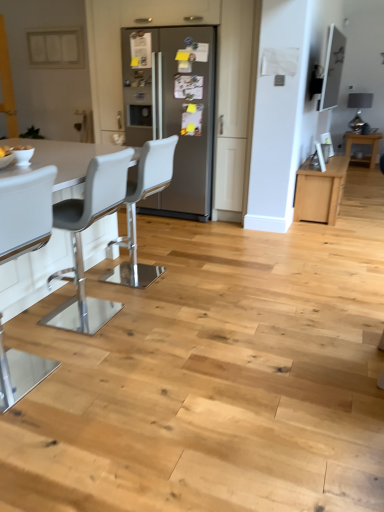
You are a GUI agent. You are given a task and a screenshot of the screen. Output one action in this format:
    pyautogui.click(x=<x>, y=<y>)
    Task: Click on the vacant area that lies in front of white plastic chair at center, positioned as the third chair in front-to-back order
    Image resolution: width=384 pixels, height=512 pixels.
    Given the screenshot: What is the action you would take?
    pyautogui.click(x=147, y=300)